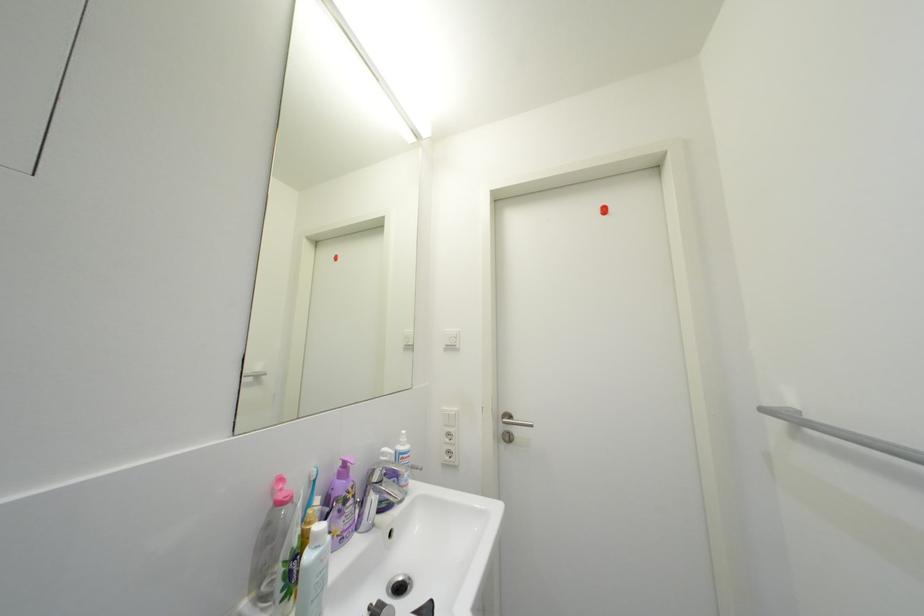
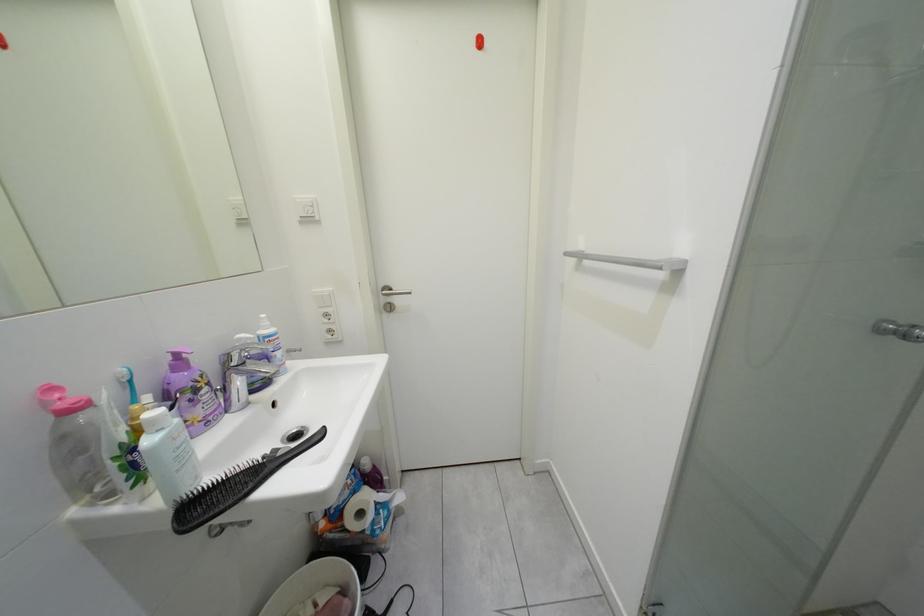
The first image is from the beginning of the video and the second image is from the end. How did the camera likely rotate when shooting the video?

The camera rotated toward right-down.